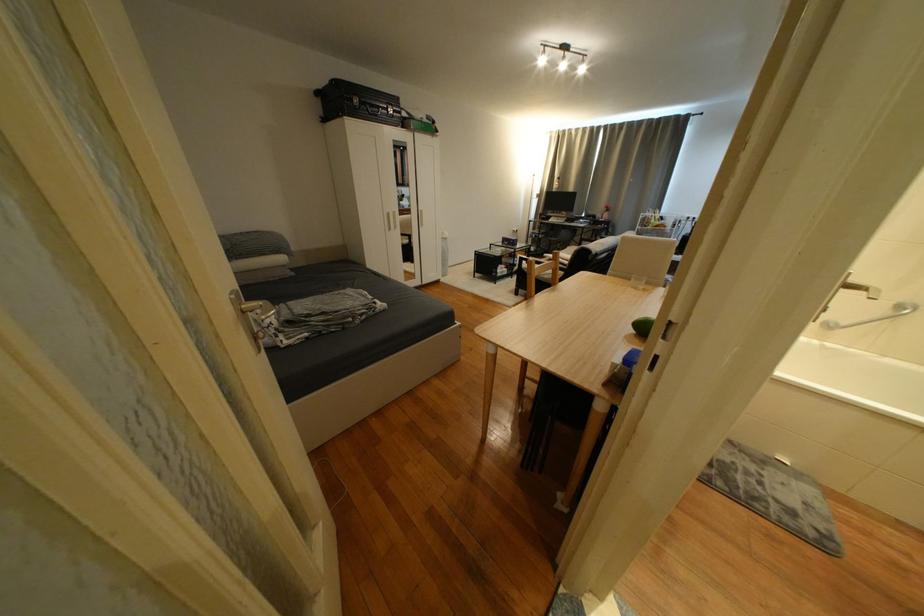
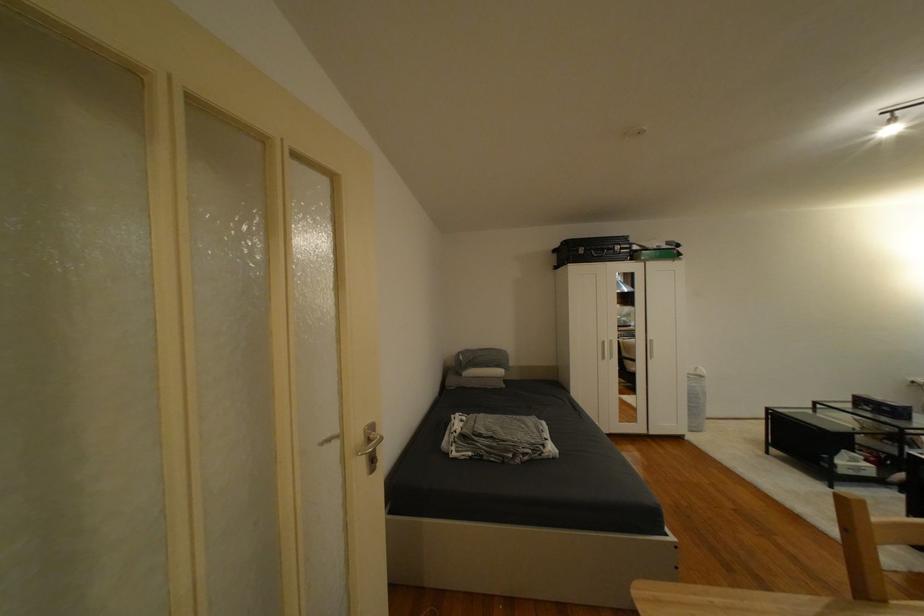
Where in the second image is the point corresponding to point 450,257 from the first image?

(698, 403)